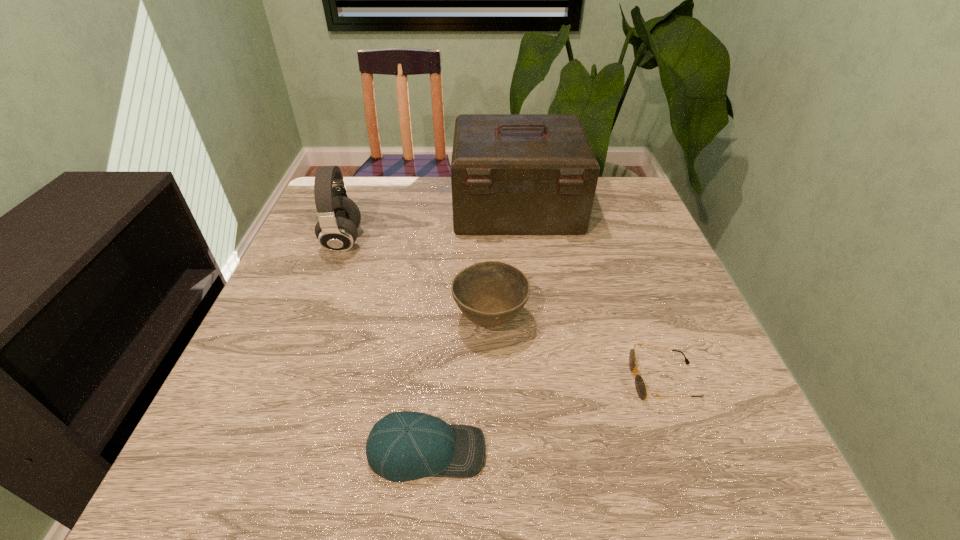
What are the coordinates of `the first-aid kit` in the screenshot? It's located at [511, 174].

Locate an element on the screen. The width and height of the screenshot is (960, 540). the fourth shortest object is located at coordinates (339, 217).

The width and height of the screenshot is (960, 540). Find the location of `headset`. headset is located at coordinates (339, 217).

This screenshot has width=960, height=540. I want to click on the third tallest object, so click(490, 293).

Image resolution: width=960 pixels, height=540 pixels. I want to click on bowl, so click(x=490, y=293).

This screenshot has width=960, height=540. I want to click on the nearest object, so click(x=402, y=446).

Identify the location of the second shortest object. Image resolution: width=960 pixels, height=540 pixels. (402, 446).

The image size is (960, 540). What are the coordinates of `the rightmost object` in the screenshot? It's located at (641, 388).

The width and height of the screenshot is (960, 540). Find the location of `sunglasses`. sunglasses is located at coordinates 641,388.

This screenshot has width=960, height=540. I want to click on free space located 0.330m on the front of the first-aid kit, so click(x=532, y=340).